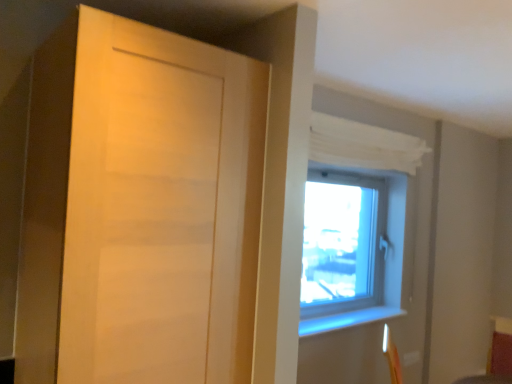
Where is `matte wood door at left`? Image resolution: width=512 pixels, height=384 pixels. matte wood door at left is located at coordinates (140, 208).

The width and height of the screenshot is (512, 384). What do you see at coordinates (140, 208) in the screenshot? I see `matte wood door at left` at bounding box center [140, 208].

In order to face white sheer curtain at upper right, should I rotate leftwards or rightwards?

You should look right and rotate roughly 15.489 degrees.

The image size is (512, 384). Describe the element at coordinates (362, 145) in the screenshot. I see `white sheer curtain at upper right` at that location.

Identify the location of white sheer curtain at upper right. (362, 145).

Locate an element on the screen. matte wood door at left is located at coordinates (140, 208).

Is white sheer curtain at upper right to the left of matte wood door at left from the viewer's perspective?

Incorrect, white sheer curtain at upper right is not on the left side of matte wood door at left.

Consider the image. Considering the positions of objects white sheer curtain at upper right and matte wood door at left in the image provided, who is in front, white sheer curtain at upper right or matte wood door at left?

matte wood door at left.

Does point (330, 152) appear closer or farther from the camera than point (259, 68)?

Point (330, 152) is positioned farther from the camera compared to point (259, 68).

From the image's perspective, would you say white sheer curtain at upper right is shown under matte wood door at left?

Incorrect, from the image's perspective, white sheer curtain at upper right is higher than matte wood door at left.

From a real-world perspective, is white sheer curtain at upper right on matte wood door at left?

Correct, in the physical world, white sheer curtain at upper right is higher than matte wood door at left.

Is white sheer curtain at upper right wider or thinner than matte wood door at left?

white sheer curtain at upper right is thinner than matte wood door at left.

From their relative heights in the image, would you say white sheer curtain at upper right is taller or shorter than matte wood door at left?

white sheer curtain at upper right is shorter than matte wood door at left.

Considering the sizes of objects white sheer curtain at upper right and matte wood door at left in the image provided, who is bigger, white sheer curtain at upper right or matte wood door at left?

matte wood door at left is bigger.

Is matte wood door at left surrounded by white sheer curtain at upper right?

No.

Is white sheer curtain at upper right placed right next to matte wood door at left?

No, white sheer curtain at upper right is not touching matte wood door at left.

Does white sheer curtain at upper right turn towards matte wood door at left?

No, white sheer curtain at upper right is not turned towards matte wood door at left.

Find the location of a particular element. This screenshot has width=512, height=384. door below the white sheer curtain at upper right (from the image's perspective) is located at coordinates pyautogui.click(x=140, y=208).

Considering the relative positions of matte wood door at left and white sheer curtain at upper right in the image provided, is matte wood door at left to the left of white sheer curtain at upper right from the viewer's perspective?

Correct, you'll find matte wood door at left to the left of white sheer curtain at upper right.

Relative to white sheer curtain at upper right, is matte wood door at left in front or behind?

matte wood door at left is positioned closer to the viewer than white sheer curtain at upper right.

Is point (164, 71) positioned after point (384, 154)?

No, (164, 71) is closer to viewer.

From the image's perspective, does matte wood door at left appear lower than white sheer curtain at upper right?

Indeed, from the image's perspective, matte wood door at left is shown beneath white sheer curtain at upper right.

From a real-world perspective, does matte wood door at left stand above white sheer curtain at upper right?

No, from a real-world perspective, matte wood door at left is not on top of white sheer curtain at upper right.

Which of these two, matte wood door at left or white sheer curtain at upper right, is wider?

matte wood door at left.

Does matte wood door at left have a greater height compared to white sheer curtain at upper right?

Correct, matte wood door at left is much taller as white sheer curtain at upper right.

Does matte wood door at left have a smaller size compared to white sheer curtain at upper right?

Actually, matte wood door at left might be larger than white sheer curtain at upper right.

Looking at this image, would you say white sheer curtain at upper right is part of matte wood door at left's contents?

No, matte wood door at left does not contain white sheer curtain at upper right.

Is matte wood door at left far from white sheer curtain at upper right?

matte wood door at left is far away from white sheer curtain at upper right.

Is matte wood door at left aimed at white sheer curtain at upper right?

No, matte wood door at left is not aimed at white sheer curtain at upper right.

How far apart are matte wood door at left and white sheer curtain at upper right?

matte wood door at left and white sheer curtain at upper right are 1.43 meters apart from each other.

The width and height of the screenshot is (512, 384). There is a matte wood door at left. Find the location of `curtain above it (from a real-world perspective)`. curtain above it (from a real-world perspective) is located at coordinates (362, 145).

Where is `curtain above the matte wood door at left (from a real-world perspective)`? This screenshot has width=512, height=384. curtain above the matte wood door at left (from a real-world perspective) is located at coordinates point(362,145).

You are a GUI agent. You are given a task and a screenshot of the screen. Output one action in this format:
    pyautogui.click(x=<x>, y=<y>)
    Task: Click on the door on the left of the white sheer curtain at upper right
    Image resolution: width=512 pixels, height=384 pixels.
    Given the screenshot: What is the action you would take?
    pyautogui.click(x=140, y=208)